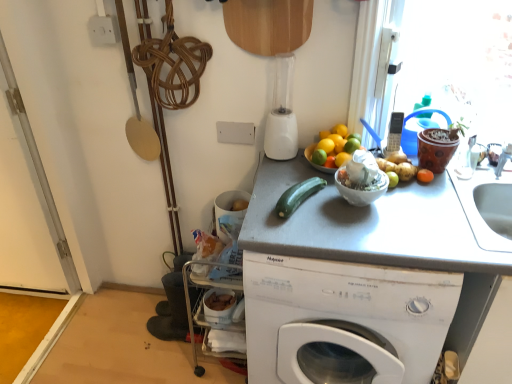
The width and height of the screenshot is (512, 384). What are the coordinates of `free space in front of green smooth-textured zucchini at center` in the screenshot? It's located at (310, 233).